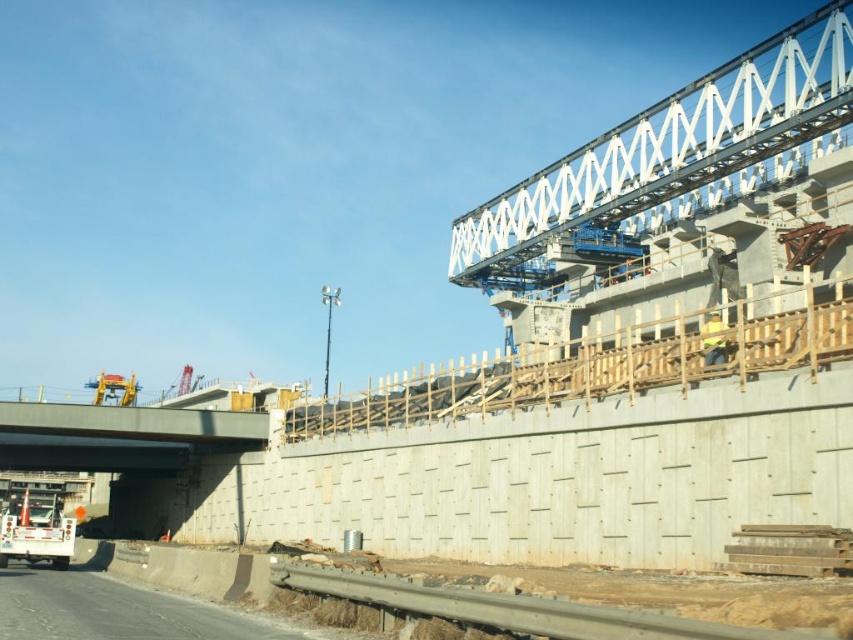
You are a construction worker standing on the gray concrete highway at lower left. You need to hand a tool to your colleague wearing the yellow reflective vest at center. Can you directly hand it to them without moving from your current position?

The gray concrete highway at lower left is in front of the yellow reflective vest at center, meaning the highway is closer to you. Since the highway is blocking your direct path, you cannot hand the tool directly without moving.

You are a construction worker standing on the road. You need to place a new safety sign on the gray metallic overpass at left. However, you notice the yellow reflective vest at center is in the way. Can you reach the overpass without moving the vest?

The gray metallic overpass at left is located below the yellow reflective vest at center, so you can reach the overpass without moving the vest since it is positioned underneath.

You are a crane operator trying to lift a heavy beam. You need to know if the gray metallic overpass at left is taller than the gray concrete highway at lower left to ensure safe clearance. Can you confirm this?

The gray metallic overpass at left is taller than the gray concrete highway at lower left, so there should be sufficient clearance for the crane to lift the beam safely.